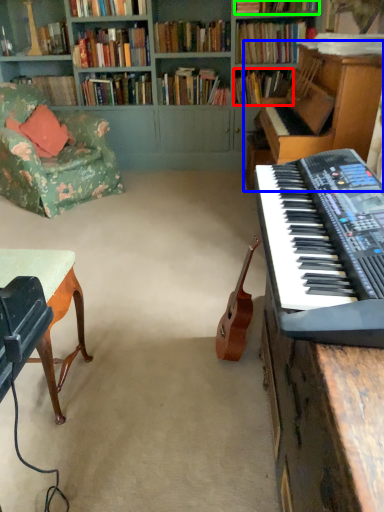
Question: Considering the real-world distances, which object is farthest from book (highlighted by a red box)? piano (highlighted by a blue box) or book (highlighted by a green box)?

Choices:
 (A) piano
 (B) book

Answer: (A)